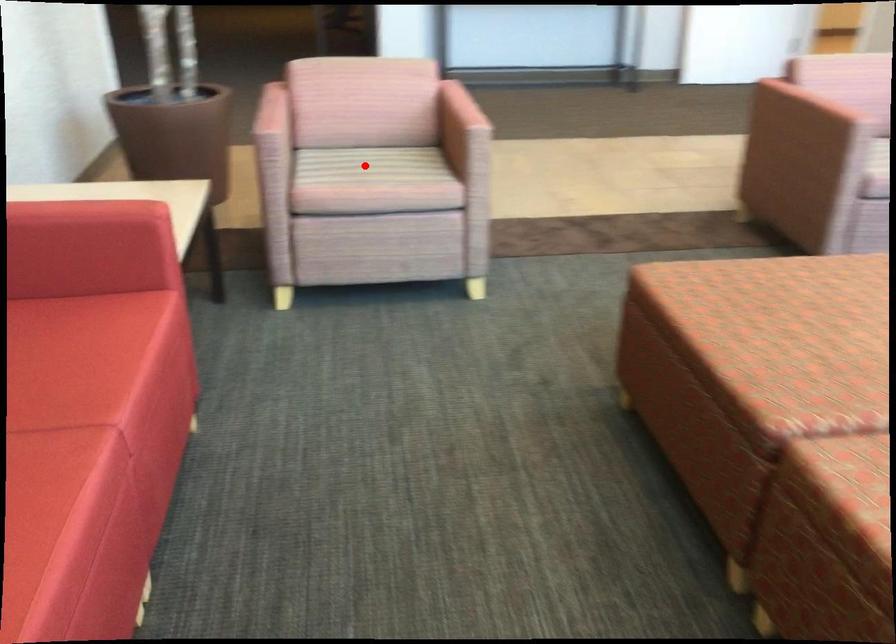
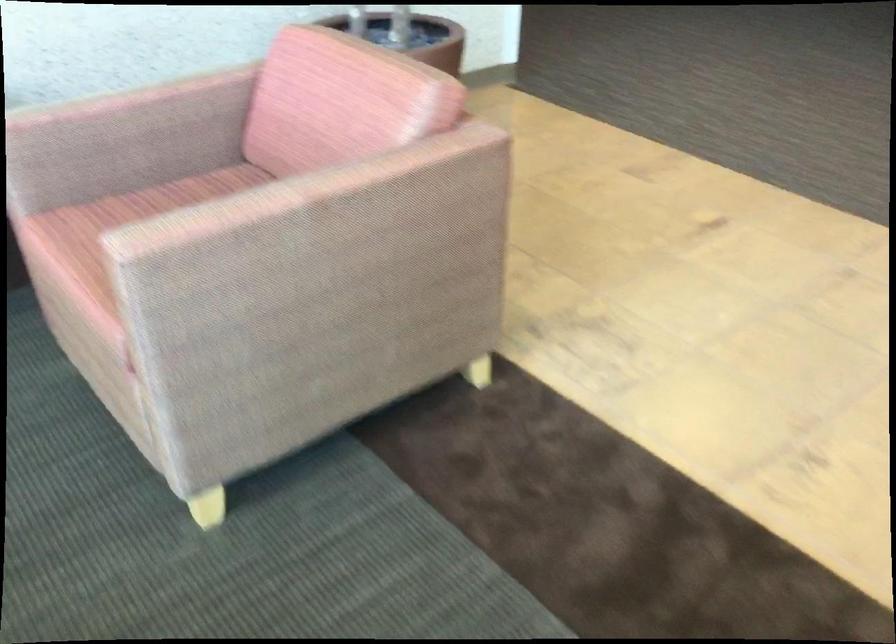
Question: I am providing you with two images of the same scene from different viewpoints. A red point is marked on the first image. At the location where the point appears in image 1, is it still visible in image 2?

Choices:
 (A) Yes
 (B) No

Answer: (B)